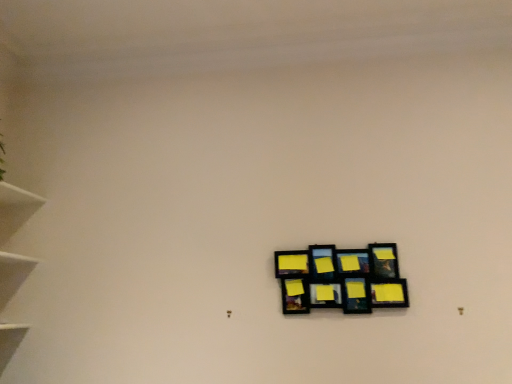
You are a GUI agent. You are given a task and a screenshot of the screen. Output one action in this format:
    pyautogui.click(x=<x>, y=<y>)
    Task: Click on the black matte picture frame at center
    The width and height of the screenshot is (512, 384).
    Given the screenshot: What is the action you would take?
    pyautogui.click(x=339, y=279)

What do you see at coordinates (339, 279) in the screenshot?
I see `black matte picture frame at center` at bounding box center [339, 279].

Identify the location of black matte picture frame at center. This screenshot has width=512, height=384. (339, 279).